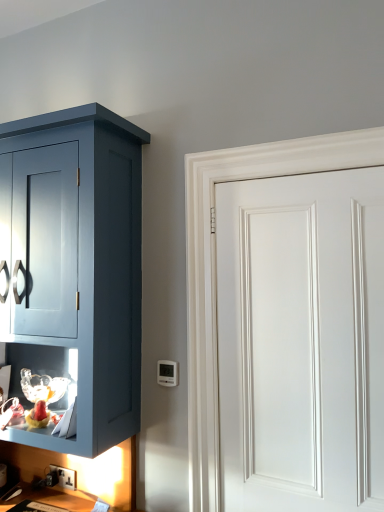
Question: Considering the relative sizes of white plastic thermostat at lower center and white smooth door at right in the image provided, is white plastic thermostat at lower center taller than white smooth door at right?

Choices:
 (A) no
 (B) yes

Answer: (A)

Question: Can you confirm if white plastic thermostat at lower center is shorter than white smooth door at right?

Choices:
 (A) yes
 (B) no

Answer: (A)

Question: Can you confirm if white plastic thermostat at lower center is smaller than white smooth door at right?

Choices:
 (A) yes
 (B) no

Answer: (A)

Question: Does white plastic thermostat at lower center have a larger size compared to white smooth door at right?

Choices:
 (A) yes
 (B) no

Answer: (B)

Question: Is white plastic thermostat at lower center oriented away from white smooth door at right?

Choices:
 (A) yes
 (B) no

Answer: (B)

Question: In terms of width, does black plastic electric outlet at lower left look wider or thinner when compared to white plastic thermostat at lower center?

Choices:
 (A) wide
 (B) thin

Answer: (B)

Question: Based on their sizes in the image, would you say black plastic electric outlet at lower left is bigger or smaller than white plastic thermostat at lower center?

Choices:
 (A) small
 (B) big

Answer: (A)

Question: Is black plastic electric outlet at lower left taller or shorter than white plastic thermostat at lower center?

Choices:
 (A) tall
 (B) short

Answer: (B)

Question: From the image's perspective, is black plastic electric outlet at lower left positioned above or below white plastic thermostat at lower center?

Choices:
 (A) above
 (B) below

Answer: (B)

Question: Choose the correct answer: Is white smooth door at right inside black plastic electric outlet at lower left or outside it?

Choices:
 (A) outside
 (B) inside

Answer: (A)

Question: Is point (319, 468) positioned closer to the camera than point (74, 471)?

Choices:
 (A) closer
 (B) farther

Answer: (A)

Question: From a real-world perspective, relative to black plastic electric outlet at lower left, is white smooth door at right vertically above or below?

Choices:
 (A) below
 (B) above

Answer: (B)

Question: From the image's perspective, relative to black plastic electric outlet at lower left, is white smooth door at right above or below?

Choices:
 (A) above
 (B) below

Answer: (A)

Question: Based on their sizes in the image, would you say white smooth door at right is bigger or smaller than white plastic thermostat at lower center?

Choices:
 (A) big
 (B) small

Answer: (A)

Question: Choose the correct answer: Is white smooth door at right inside white plastic thermostat at lower center or outside it?

Choices:
 (A) inside
 (B) outside

Answer: (B)